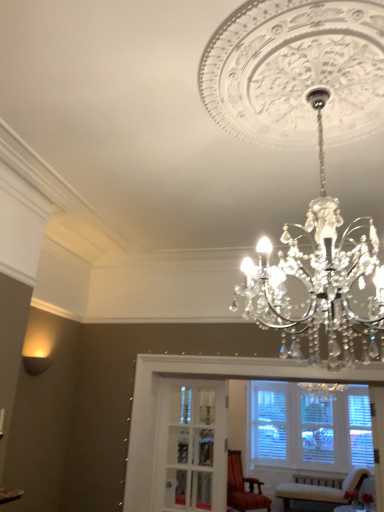
Question: Is matte black wall sconce at lower left wider or thinner than velvet beige chair at lower right, the 1th chair from the right?

Choices:
 (A) wide
 (B) thin

Answer: (B)

Question: Considering their positions, is matte black wall sconce at lower left located in front of or behind velvet beige chair at lower right, the 1th chair from the right?

Choices:
 (A) front
 (B) behind

Answer: (A)

Question: Which object is positioned farthest from the wooden armchair at center, arranged as the 2th chair when viewed from the right?

Choices:
 (A) clear glass door at center
 (B) velvet beige chair at lower right, the 1th chair from the right
 (C) matte black wall sconce at lower left

Answer: (C)

Question: Based on their relative distances, which object is farther from the velvet beige chair at lower right, the 1th chair from the right?

Choices:
 (A) clear glass door at center
 (B) matte black wall sconce at lower left
 (C) wooden armchair at center, placed as the first chair when sorted from left to right

Answer: (B)